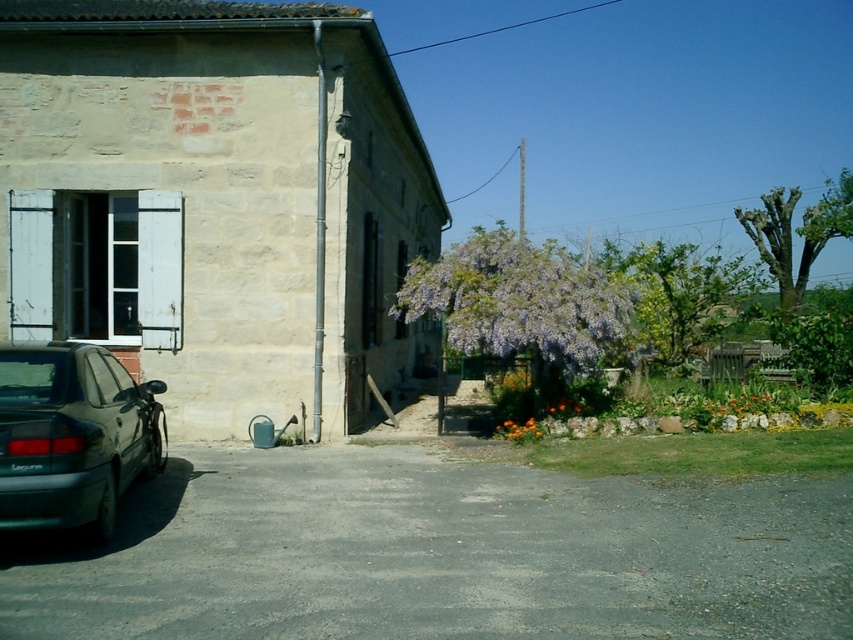
Question: Which of these objects is positioned farthest from the orange matte flower at center?

Choices:
 (A) purple matte flowers at center
 (B) green leafy tree at upper right
 (C) metallic gray sedan at lower left

Answer: (B)

Question: Is purple leafy tree at center wider than orange matte flower at center?

Choices:
 (A) yes
 (B) no

Answer: (A)

Question: Among these objects, which one is nearest to the camera?

Choices:
 (A) gray asphalt driveway at lower center
 (B) green leafy tree at upper right
 (C) purple matte flowers at center
 (D) purple leafy tree at center

Answer: (A)

Question: Is green leafy tree at upper right thinner than orange matte flower at center?

Choices:
 (A) no
 (B) yes

Answer: (A)

Question: Can you confirm if gray asphalt driveway at lower center is bigger than orange matte flower at center?

Choices:
 (A) no
 (B) yes

Answer: (A)

Question: Which of the following is the closest to the observer?

Choices:
 (A) (55, 477)
 (B) (717, 291)
 (C) (552, 349)

Answer: (A)